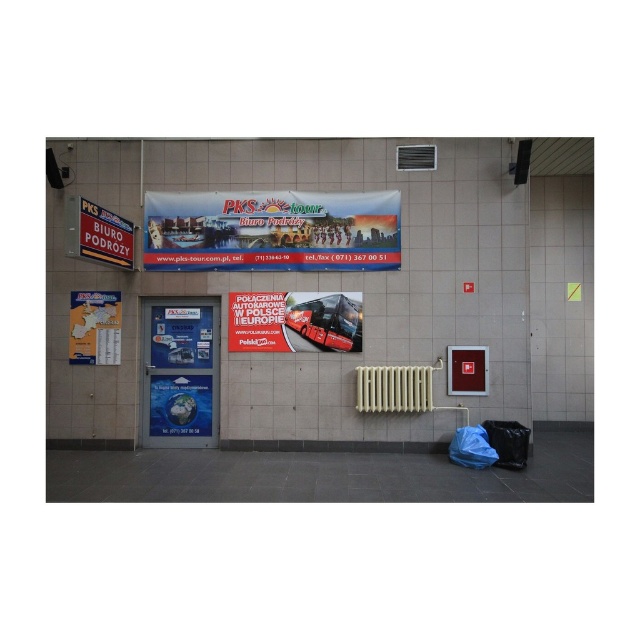
You are standing in front of the building and want to read the information on the blue glossy poster at center and the white plastic radiator at center. Which one is narrower?

The blue glossy poster at center is thinner than the white plastic radiator at center, so it is narrower.

In the scene shown: What is the spatial relationship between the red glossy bus at center and the white plastic radiator at center?

The white plastic radiator at center is behind the red glossy bus at center.

You are a delivery person who needs to park your van between the red glossy bus at center and the white plastic radiator at center. Can you fit your van there if it requires 2 meters of space?

The red glossy bus at center is positioned on the left side of white plastic radiator at center, but the exact distance between them isn not provided. Therefore, it is uncertain if the van can fit there.